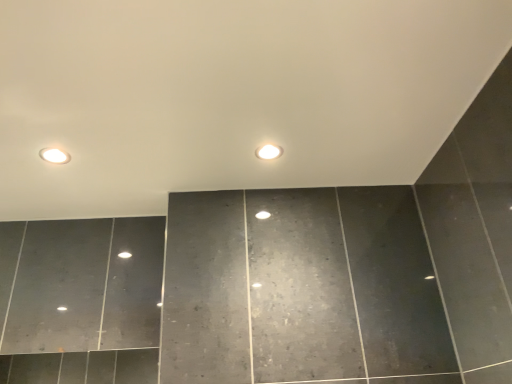
Question: Relative to white glossy light bulb at center, is matte white recessed light at upper left in front or behind?

Choices:
 (A) front
 (B) behind

Answer: (A)

Question: From the image's perspective, is matte white recessed light at upper left above or below white glossy light bulb at center?

Choices:
 (A) above
 (B) below

Answer: (B)

Question: Is point (65, 153) positioned closer to the camera than point (266, 153)?

Choices:
 (A) farther
 (B) closer

Answer: (B)

Question: Considering the positions of white glossy light bulb at center and matte white recessed light at upper left in the image, is white glossy light bulb at center taller or shorter than matte white recessed light at upper left?

Choices:
 (A) short
 (B) tall

Answer: (B)

Question: From a real-world perspective, is white glossy light bulb at center above or below matte white recessed light at upper left?

Choices:
 (A) above
 (B) below

Answer: (B)

Question: From the image's perspective, is white glossy light bulb at center above or below matte white recessed light at upper left?

Choices:
 (A) above
 (B) below

Answer: (A)

Question: In terms of size, does white glossy light bulb at center appear bigger or smaller than matte white recessed light at upper left?

Choices:
 (A) small
 (B) big

Answer: (B)